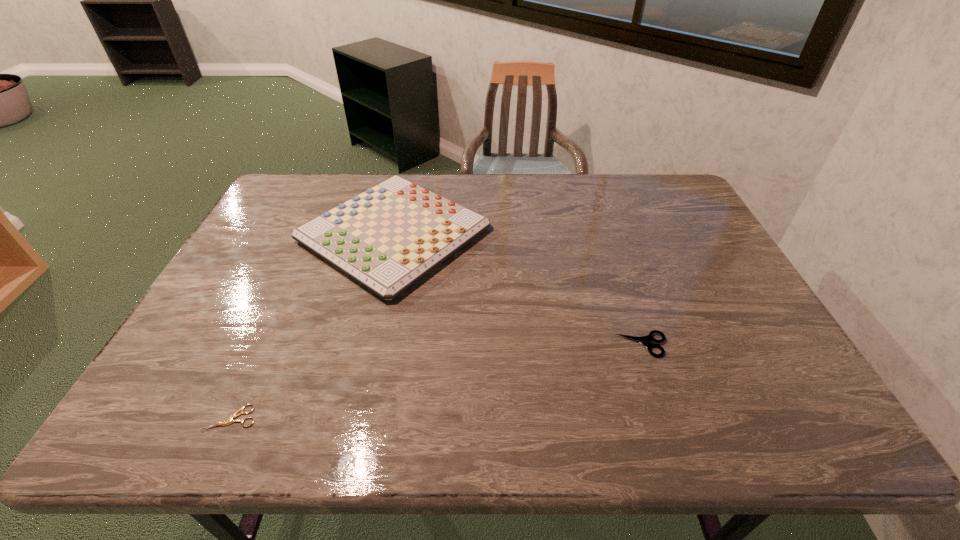
Identify which object is the second closest to the rightmost object. Please provide its 2D coordinates. Your answer should be formatted as a tuple, i.e. [(x, y)], where the tuple contains the x and y coordinates of a point satisfying the conditions above.

[(235, 415)]

At what (x,y) coordinates should I click in order to perform the action: click on free space that satisfies the following two spatial constraints: 1. on the front side of the tallest object; 2. on the left side of the right shears. Please return your answer as a coordinate pair (x, y). This screenshot has height=540, width=960. Looking at the image, I should click on coord(368,345).

Identify the location of blank area in the image that satisfies the following two spatial constraints: 1. on the back side of the nearest object; 2. on the left side of the taller shears. (264, 345).